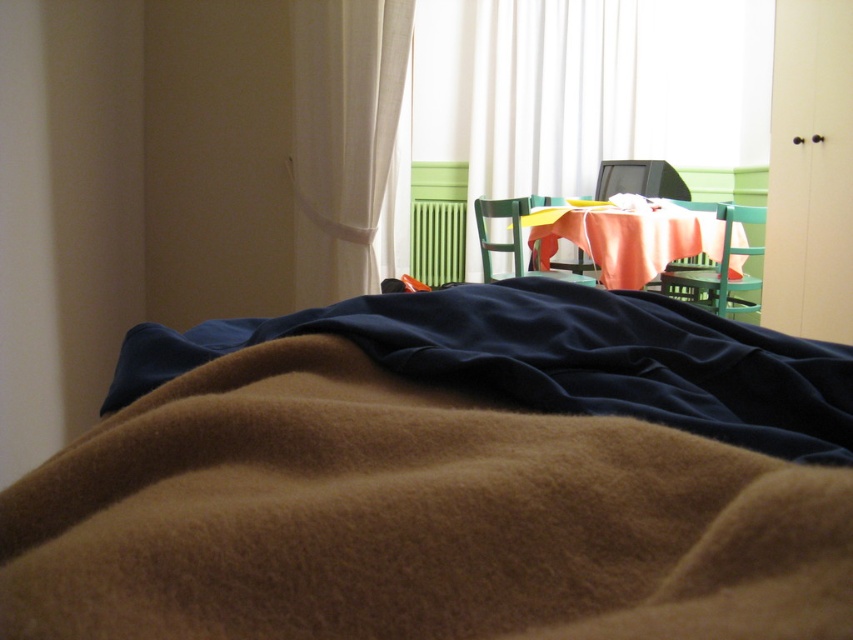
Question: Can you confirm if white fabric curtain at upper left is positioned to the right of orange fabric-covered table at center?

Choices:
 (A) yes
 (B) no

Answer: (B)

Question: Which point appears farthest from the camera in this image?

Choices:
 (A) (496, 372)
 (B) (694, 220)

Answer: (B)

Question: Is white fabric curtain at upper left bigger than wooden chair at center?

Choices:
 (A) no
 (B) yes

Answer: (B)

Question: Estimate the real-world distances between objects in this image. Which object is closer to the green plastic chair at center?

Choices:
 (A) brown fuzzy blanket at center
 (B) wooden chair at center
 (C) brown woolen blanket at lower center

Answer: (B)

Question: Can you confirm if brown fuzzy blanket at center is wider than orange fabric-covered table at center?

Choices:
 (A) no
 (B) yes

Answer: (A)

Question: Among these points, which one is nearest to the camera?

Choices:
 (A) (334, 480)
 (B) (581, 253)
 (C) (669, 282)
 (D) (363, 243)

Answer: (A)